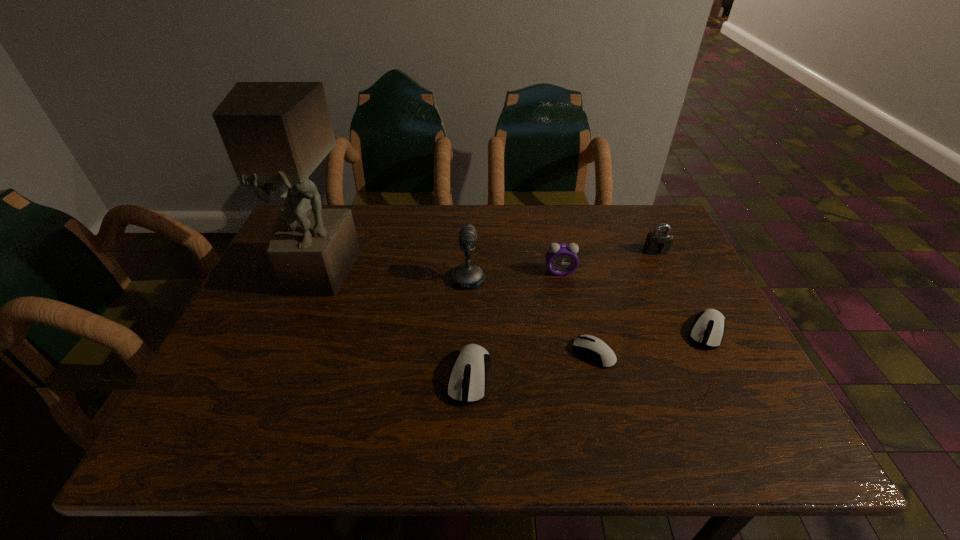
I want to click on the third shortest object, so click(x=467, y=381).

The width and height of the screenshot is (960, 540). Identify the location of the leftmost mouse. (467, 381).

This screenshot has height=540, width=960. I want to click on the second mouse from right to left, so click(x=595, y=349).

This screenshot has width=960, height=540. What are the coordinates of `the shortest object` in the screenshot? It's located at (595, 349).

Identify the location of the second tallest mouse. This screenshot has height=540, width=960. (708, 329).

Locate an element on the screen. This screenshot has height=540, width=960. the rightmost mouse is located at coordinates (708, 329).

The width and height of the screenshot is (960, 540). What are the coordinates of `the leftmost object` in the screenshot? It's located at (275, 133).

You are a GUI agent. You are given a task and a screenshot of the screen. Output one action in this format:
    pyautogui.click(x=<x>, y=<y>)
    Task: Click on the tallest object
    Image resolution: width=960 pixels, height=540 pixels.
    Given the screenshot: What is the action you would take?
    pyautogui.click(x=275, y=133)

Locate an element on the screen. This screenshot has width=960, height=540. microphone is located at coordinates (466, 275).

Locate an element on the screen. padlock is located at coordinates (658, 242).